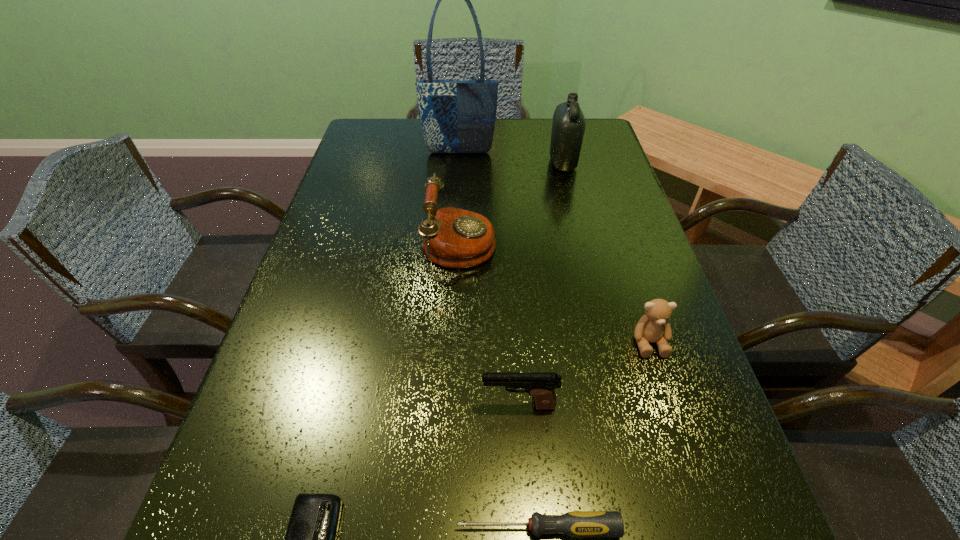
Find the location of `blank space at the far edge of the desktop`. blank space at the far edge of the desktop is located at coordinates (538, 129).

Identify the location of free space at the left edge. (392, 172).

What are the coordinates of `blank space at the right edge of the desktop` in the screenshot? It's located at (617, 317).

Locate an element on the screen. This screenshot has width=960, height=540. vacant space at the far left corner of the desktop is located at coordinates (400, 134).

What are the coordinates of `empty location between the sixth shortest object and the rightmost object` in the screenshot? It's located at (606, 253).

At what (x,y) coordinates should I click in order to perform the action: click on vacant area that lies between the pistol and the fourth farthest object. Please return your answer as a coordinate pair (x, y). The width and height of the screenshot is (960, 540). Looking at the image, I should click on (584, 374).

You are a GUI agent. You are given a task and a screenshot of the screen. Output one action in this format:
    pyautogui.click(x=<x>, y=<y>)
    Task: Click on the blank region between the third nearest object and the fourth farthest object
    The width and height of the screenshot is (960, 540).
    Given the screenshot: What is the action you would take?
    pyautogui.click(x=584, y=374)

Where is `vacant space that's between the pistol and the sixth object from left to right`? The height and width of the screenshot is (540, 960). vacant space that's between the pistol and the sixth object from left to right is located at coordinates (541, 284).

Select which object appears as the sixth closest to the leftmost object. Please provide its 2D coordinates. Your answer should be formatted as a tuple, i.e. [(x, y)], where the tuple contains the x and y coordinates of a point satisfying the conditions above.

[(457, 116)]

Identify which object is the closest to the screwdriver. Please provide its 2D coordinates. Your answer should be formatted as a tuple, i.e. [(x, y)], where the tuple contains the x and y coordinates of a point satisfying the conditions above.

[(541, 386)]